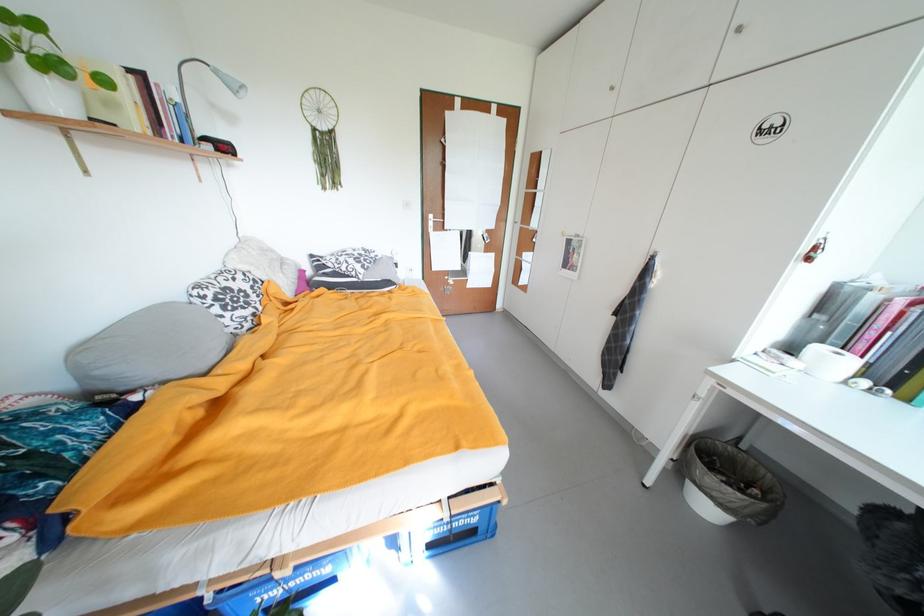
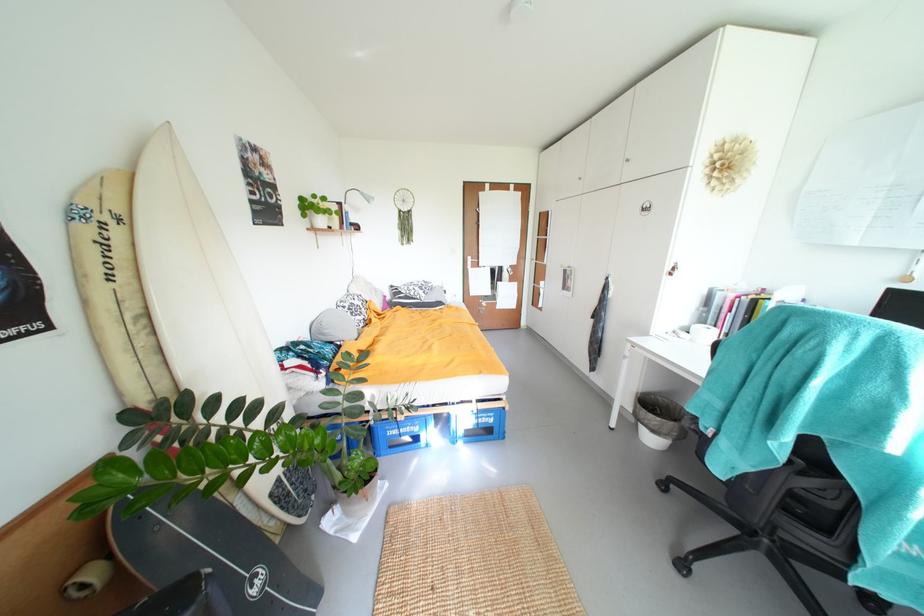
In the second image, find the point that corresponds to point 105,374 in the first image.

(333, 333)